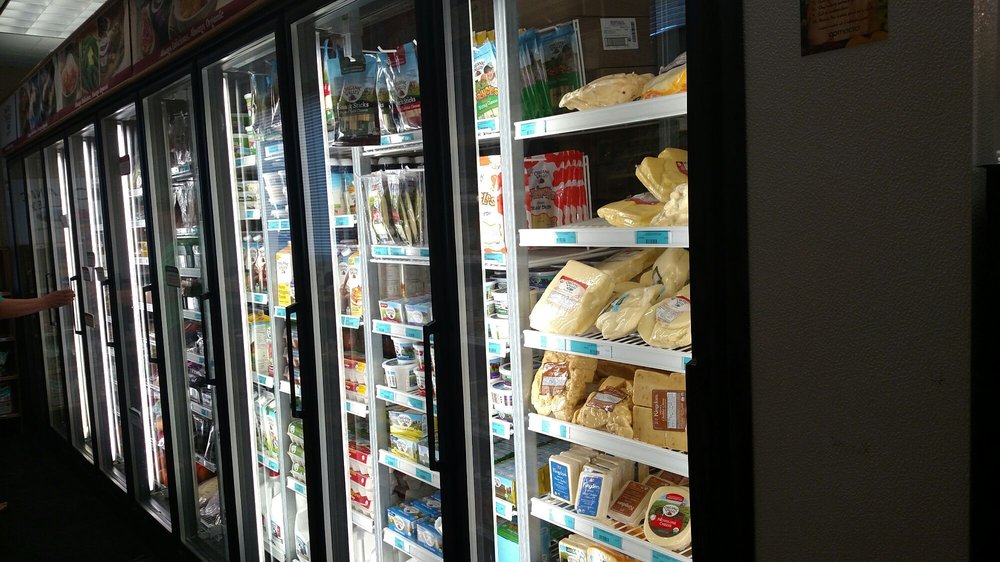
Where is `refridgerator glass doors`? refridgerator glass doors is located at coordinates (571, 289), (380, 269), (267, 262), (189, 248), (137, 233), (99, 224), (65, 226), (39, 233).